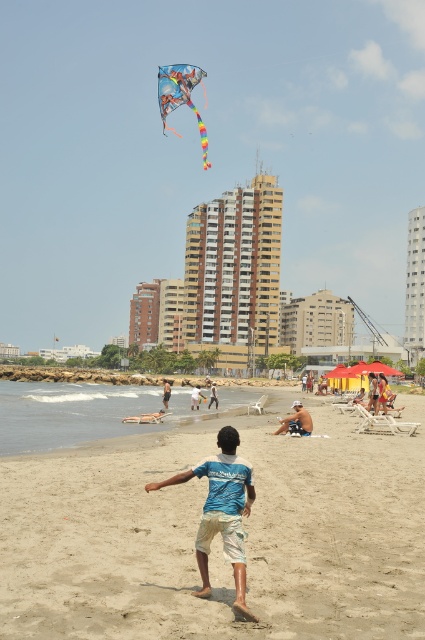
You are a photographer trying to capture a candid shot of the young boy in the blue cotton shirt at center and blue denim shorts at center. To ensure both items are clearly visible, which one should you focus on first?

The blue denim shorts at center is larger than the blue cotton shirt at center, so you should focus on the blue denim shorts at center first to ensure clarity.

You are a photographer trying to capture a candid shot of the white cotton shorts at center without including the blue denim shorts at center in the frame. Is this possible given their positions?

The blue denim shorts at center is in front of the white cotton shorts at center, so it would block the view of the white cotton shorts at center. Therefore, it is not possible to capture the white cotton shorts at center without including the blue denim shorts at center in the frame.

You are a photographer standing at the edge of the beach. You want to take a photo of the blue denim shorts at center and the white cotton shorts at center. Which of the two will appear taller in the photo?

The white cotton shorts at center will appear taller in the photo since the blue denim shorts at center is not as tall as white cotton shorts at center.